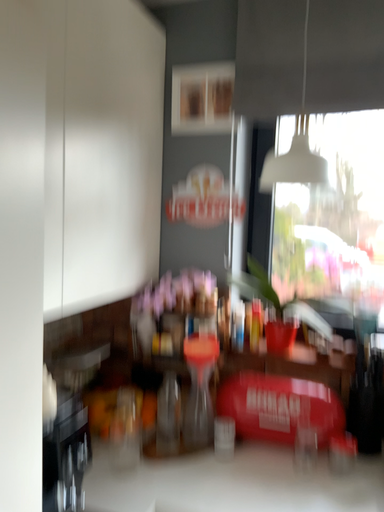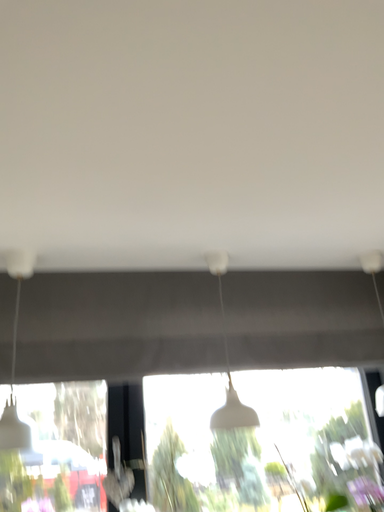
Question: How did the camera likely rotate when shooting the video?

Choices:
 (A) rotated downward
 (B) rotated upward

Answer: (B)